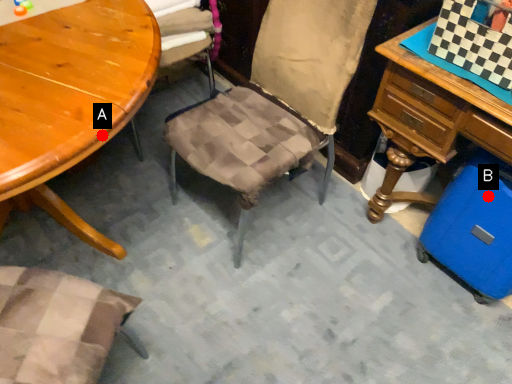
Question: Two points are circled on the image, labeled by A and B beside each circle. Among these points, which one is farthest from the camera?

Choices:
 (A) A is further
 (B) B is further

Answer: (B)